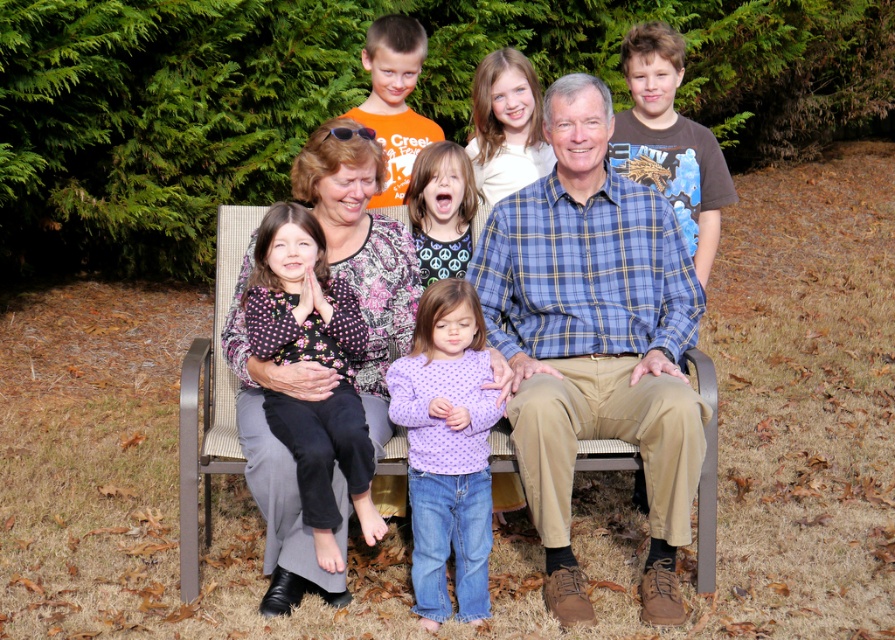
You are a photographer trying to capture the matte plaid shirt at center and the purple dotted shirt at center in the same frame. Which shirt should you adjust to the left to ensure both are visible?

The matte plaid shirt at center is positioned on the right side of the purple dotted shirt at center, so you should move the purple dotted shirt at center to the left to include both in the frame.

You are standing at the edge of the gathering and want to hand a snack to both the person wearing the blue plaid shirt at center and the purple dotted shirt at center. If your reach is 20 inches, can you reach both without moving? Please explain.

The blue plaid shirt at center is 23.44 inches away from the purple dotted shirt at center. Since your reach is only 20 inches, you cannot reach both without moving closer to at least one of them.